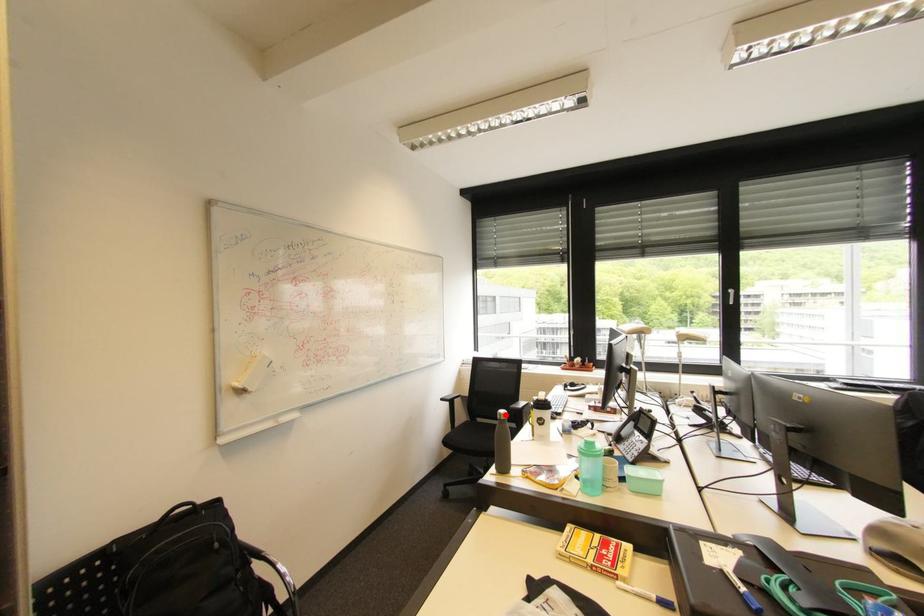
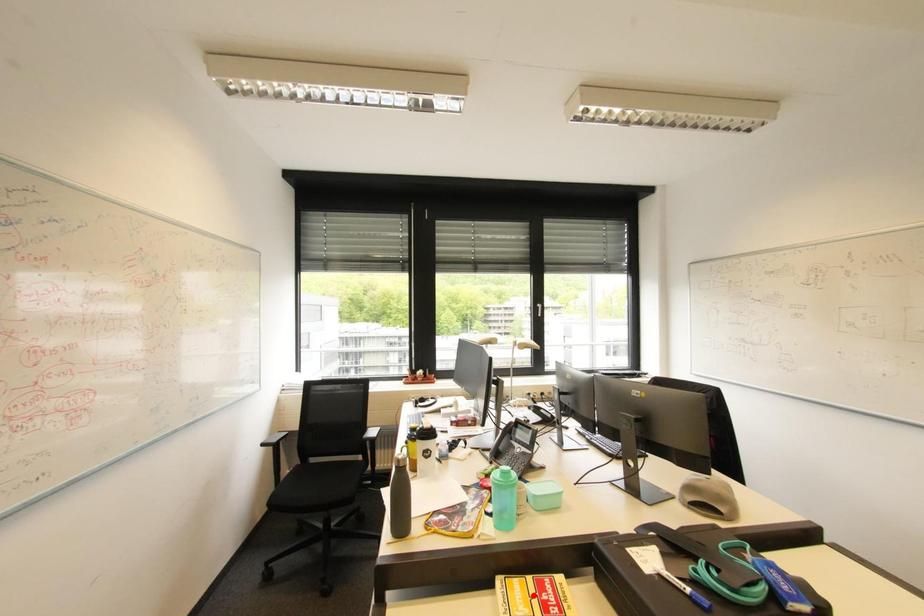
I am providing you with two images of the same scene from different viewpoints. A red point is marked on the first image and another point is marked on the second image. Do the highlighted points in image1 and image2 indicate the same real-world spot?

No